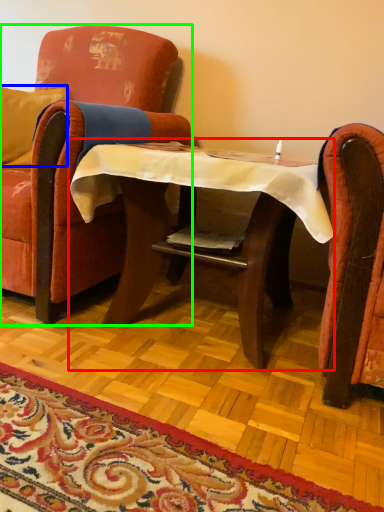
Question: Based on their relative distances, which object is nearer to table (highlighted by a red box)? Choose from pillow (highlighted by a blue box) and chair (highlighted by a green box).

Choices:
 (A) pillow
 (B) chair

Answer: (B)